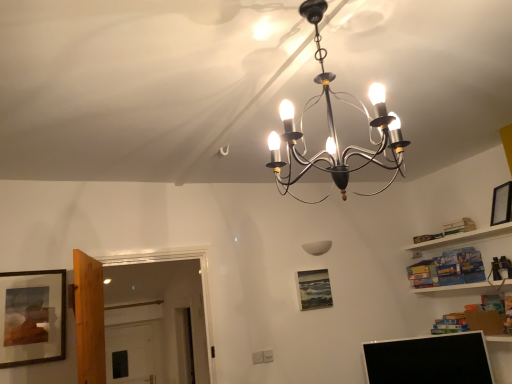
Question: Would you say black matte picture frame at upper right, the 2th picture frame in the front-to-back sequence, is to the left or to the right of white matte wall lamp at center, which ranks as the 2th lamp in top-to-bottom order, in the picture?

Choices:
 (A) left
 (B) right

Answer: (B)

Question: Based on their sizes in the image, would you say black matte picture frame at upper right, placed as the 3th picture frame when sorted from bottom to top, is bigger or smaller than white matte wall lamp at center, marked as the 1th lamp in a back-to-front arrangement?

Choices:
 (A) small
 (B) big

Answer: (B)

Question: Estimate the real-world distances between objects in this image. Which object is closer to the wooden-framed painting at left, the 2th picture frame viewed from the top?

Choices:
 (A) metallic chandelier at center, acting as the 1th lamp starting from the top
 (B) black matte picture frame at upper right, the 2th picture frame in the back-to-front sequence
 (C) white matte wall lamp at center, which ranks as the 2th lamp in top-to-bottom order
 (D) matte black picture frame at center, acting as the second picture frame starting from the left
 (E) black glossy computer monitor at lower right

Answer: (A)

Question: Which object is positioned closest to the wooden-framed painting at left, placed as the 2th picture frame when sorted from bottom to top?

Choices:
 (A) black matte picture frame at upper right, which is the first picture frame from right to left
 (B) metallic chandelier at center, acting as the 1th lamp starting from the top
 (C) black glossy computer monitor at lower right
 (D) matte black picture frame at center, the first picture frame from the back
 (E) white matte wall lamp at center, which ranks as the 2th lamp in top-to-bottom order

Answer: (B)